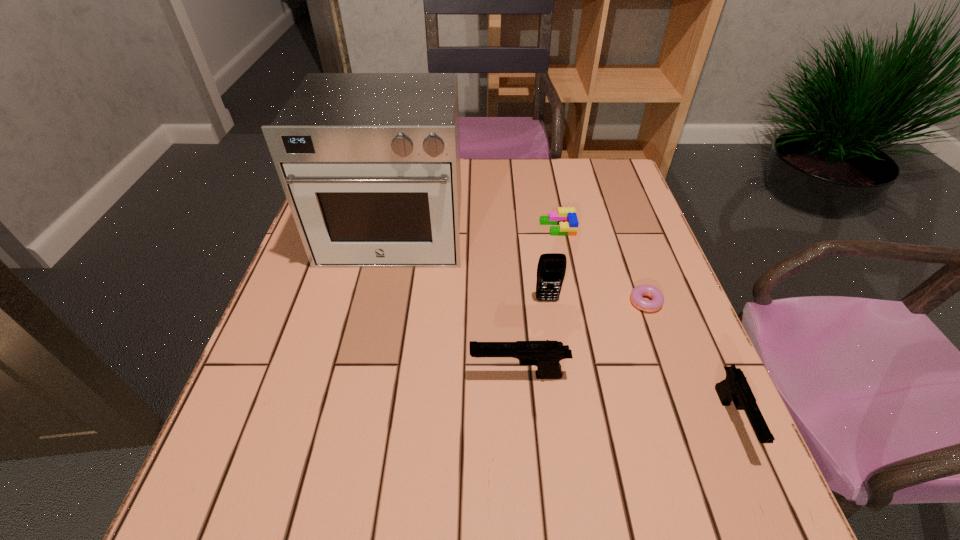
You are a GUI agent. You are given a task and a screenshot of the screen. Output one action in this format:
    pyautogui.click(x=<x>, y=<y>)
    Task: Click on the free space located on the front-facing side of the second nearest object
    The image size is (960, 540).
    Given the screenshot: What is the action you would take?
    pyautogui.click(x=290, y=375)

Where is `vacant area located 0.290m on the front-facing side of the second nearest object`? vacant area located 0.290m on the front-facing side of the second nearest object is located at coordinates (321, 375).

Locate an element on the screen. This screenshot has height=540, width=960. vacant space located 0.170m on the front-facing side of the second nearest object is located at coordinates (382, 375).

Identify the location of free location located 0.400m on the left of the Lego. (391, 228).

At what (x,y) coordinates should I click in order to perform the action: click on vacant area situated on the front panel of the tallest object. Please return your answer as a coordinate pair (x, y). Image resolution: width=960 pixels, height=540 pixels. Looking at the image, I should click on (356, 403).

The image size is (960, 540). What are the coordinates of `vacant space located 0.240m on the front of the shortest object` in the screenshot? It's located at (688, 422).

Identify the location of vacant region located on the screen of the cellular telephone. The height and width of the screenshot is (540, 960). (554, 344).

Identify the location of object present at the far edge. The image size is (960, 540). (369, 162).

What are the coordinates of `object located in the near edge section of the desktop` in the screenshot? It's located at (734, 387).

You are a GUI agent. You are given a task and a screenshot of the screen. Output one action in this format:
    pyautogui.click(x=<x>, y=<y>)
    Task: Click on the object located in the left edge section of the desktop
    This screenshot has width=960, height=540.
    Given the screenshot: What is the action you would take?
    tap(369, 162)